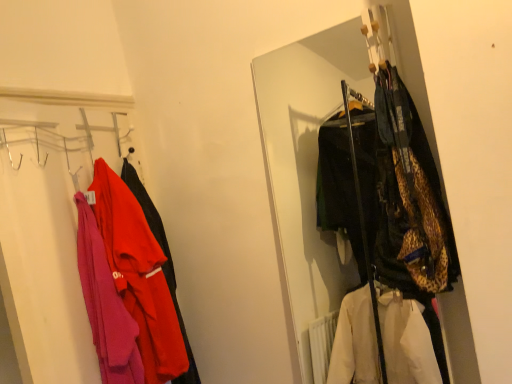
Question: Is matte pink sweater at left, marked as the 1th closet in a left-to-right arrangement, a part of matte red jacket at left?

Choices:
 (A) yes
 (B) no

Answer: (B)

Question: From a real-world perspective, is matte red jacket at left positioned over matte pink sweater at left, which is the second closet in right-to-left order, based on gravity?

Choices:
 (A) no
 (B) yes

Answer: (A)

Question: Can you confirm if matte red jacket at left is shorter than matte pink sweater at left, which is the second closet in right-to-left order?

Choices:
 (A) yes
 (B) no

Answer: (A)

Question: Does matte red jacket at left appear on the left side of matte pink sweater at left, which is the second closet in right-to-left order?

Choices:
 (A) yes
 (B) no

Answer: (B)

Question: Is matte red jacket at left wider than matte pink sweater at left, which is the second closet in right-to-left order?

Choices:
 (A) no
 (B) yes

Answer: (B)

Question: Can you confirm if matte red jacket at left is thinner than matte pink sweater at left, which is the second closet in right-to-left order?

Choices:
 (A) yes
 (B) no

Answer: (B)

Question: Is matte red jacket at left located outside leopard print jacket at center, which ranks as the first closet in right-to-left order?

Choices:
 (A) no
 (B) yes

Answer: (B)

Question: Could you tell me if matte red jacket at left is turned towards leopard print jacket at center, arranged as the 2th closet when viewed from the left?

Choices:
 (A) no
 (B) yes

Answer: (A)

Question: Is matte red jacket at left placed right next to leopard print jacket at center, which ranks as the first closet in right-to-left order?

Choices:
 (A) no
 (B) yes

Answer: (A)

Question: Can leopard print jacket at center, arranged as the 2th closet when viewed from the left, be found inside matte red jacket at left?

Choices:
 (A) yes
 (B) no

Answer: (B)

Question: Can you confirm if matte red jacket at left is thinner than leopard print jacket at center, arranged as the 2th closet when viewed from the left?

Choices:
 (A) no
 (B) yes

Answer: (B)

Question: Can you confirm if matte red jacket at left is positioned to the right of leopard print jacket at center, arranged as the 2th closet when viewed from the left?

Choices:
 (A) no
 (B) yes

Answer: (A)

Question: Is matte pink sweater at left, marked as the 1th closet in a left-to-right arrangement, taller than leopard print jacket at center, arranged as the 2th closet when viewed from the left?

Choices:
 (A) yes
 (B) no

Answer: (A)